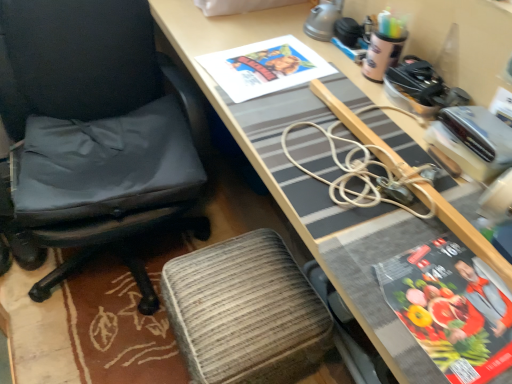
The height and width of the screenshot is (384, 512). In order to click on free spot above textured fabric stool at lower center (from a real-world perspective) in this screenshot , I will do `click(240, 289)`.